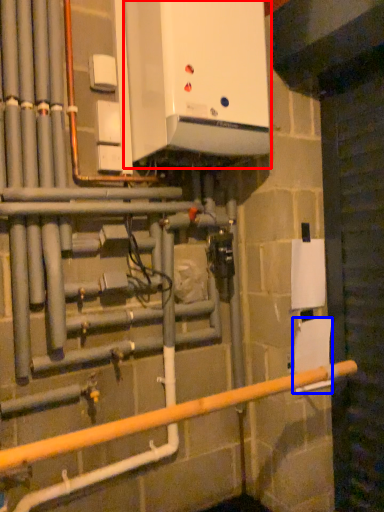
Question: Which of the following is the closest to the observer, home appliance (highlighted by a red box) or toilet paper (highlighted by a blue box)?

Choices:
 (A) home appliance
 (B) toilet paper

Answer: (A)